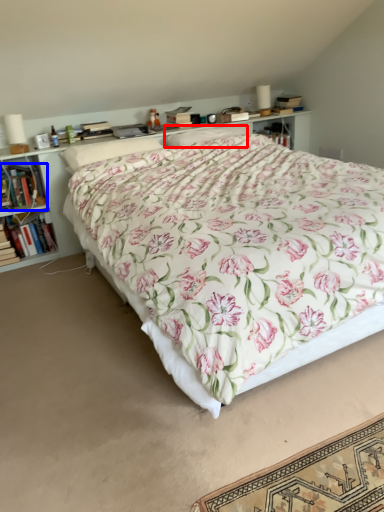
Question: Which object appears farthest to the camera in this image, pillow (highlighted by a red box) or book (highlighted by a blue box)?

Choices:
 (A) pillow
 (B) book

Answer: (A)